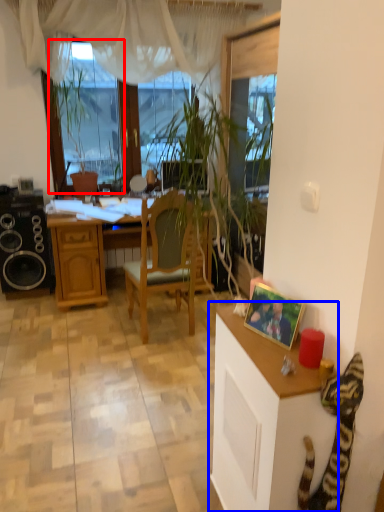
Question: Among these objects, which one is nearest to the camera, window screen (highlighted by a red box) or cabinetry (highlighted by a blue box)?

Choices:
 (A) window screen
 (B) cabinetry

Answer: (B)